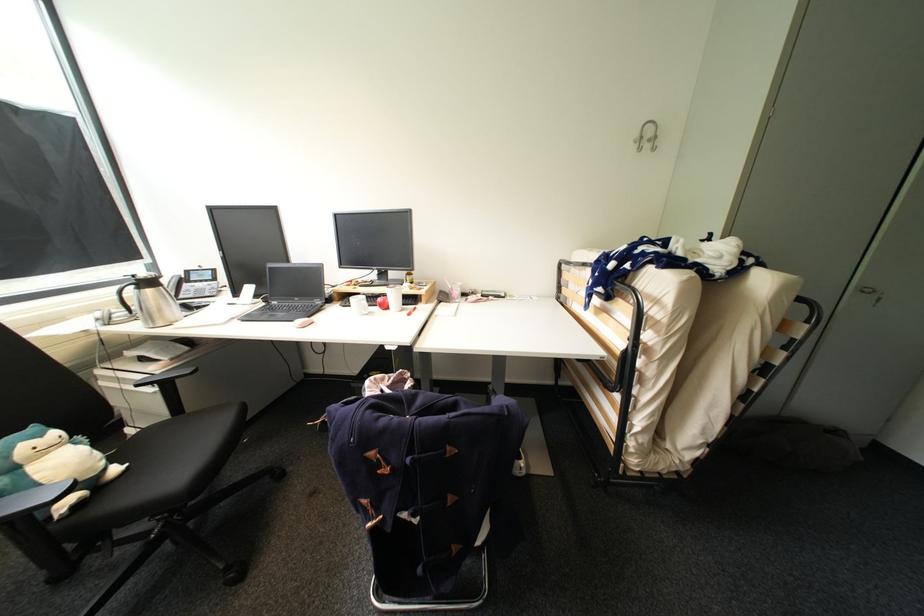
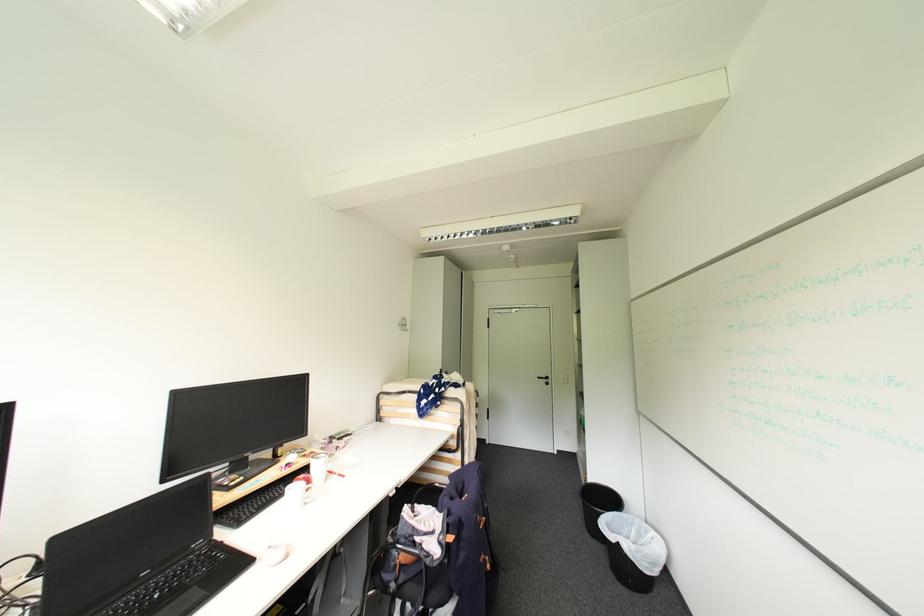
Find the pixel in the second image that matches pixel 302 300 in the first image.

(150, 575)